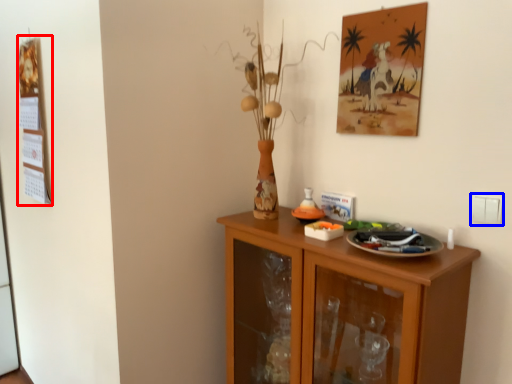
Question: Among these objects, which one is nearest to the camera, bulletin board (highlighted by a red box) or electric outlet (highlighted by a blue box)?

Choices:
 (A) bulletin board
 (B) electric outlet

Answer: (B)